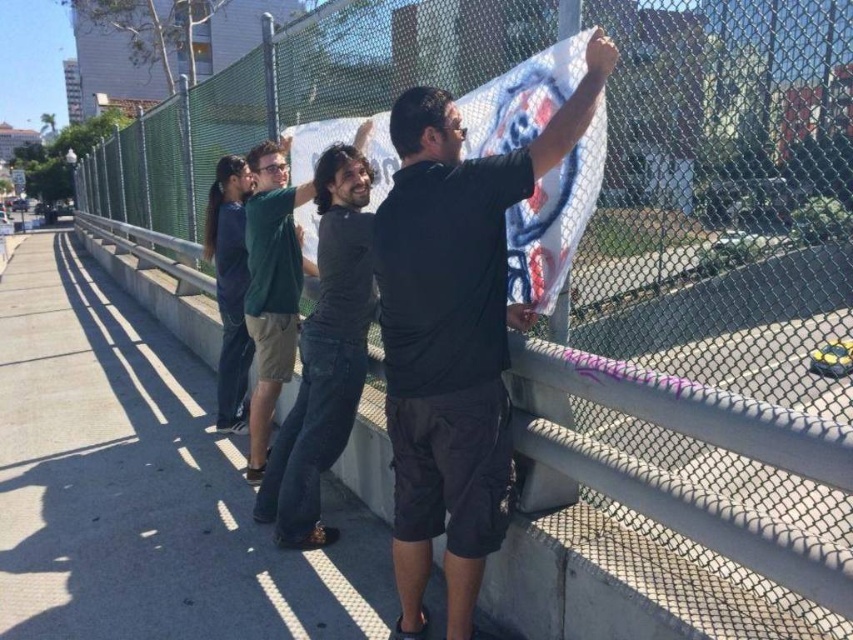
Question: Does black matte shirt at center have a lesser width compared to dark gray cotton shirt at center?

Choices:
 (A) no
 (B) yes

Answer: (A)

Question: Among these objects, which one is farthest from the camera?

Choices:
 (A) dark gray cotton shirt at center
 (B) black matte shirt at center

Answer: (A)

Question: From the image, what is the correct spatial relationship of black matte shirt at center in relation to dark gray cotton shirt at center?

Choices:
 (A) left
 (B) right

Answer: (B)

Question: Does black matte shirt at center have a larger size compared to dark gray cotton shirt at center?

Choices:
 (A) no
 (B) yes

Answer: (B)